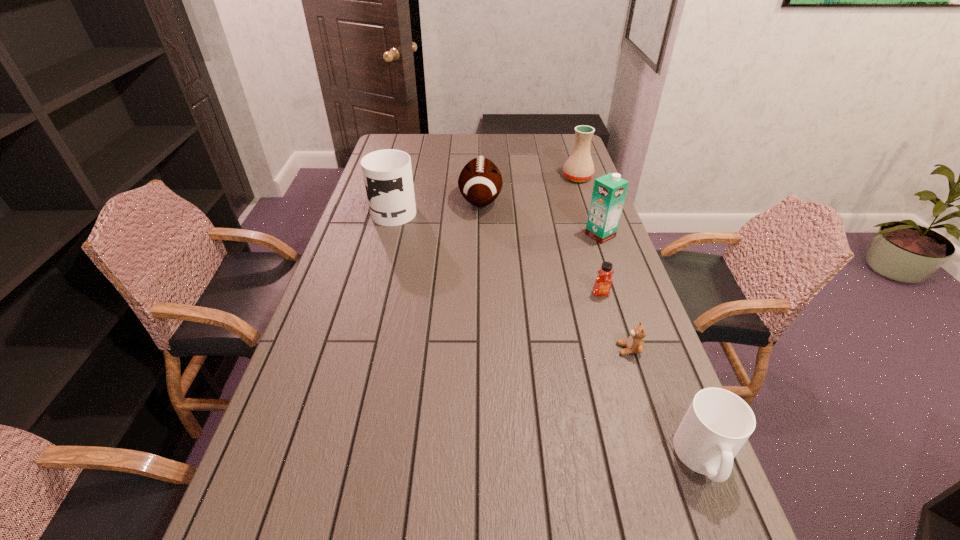
At what (x,y) coordinates should I click in order to perform the action: click on the farther mug. Please return your answer as a coordinate pair (x, y). Image resolution: width=960 pixels, height=540 pixels. Looking at the image, I should click on (387, 173).

Image resolution: width=960 pixels, height=540 pixels. Find the location of `the taller mug`. the taller mug is located at coordinates (387, 173).

Find the location of a particular element. The width and height of the screenshot is (960, 540). the nearest object is located at coordinates (718, 422).

At what (x,y) coordinates should I click in order to perform the action: click on the third shortest object. Please return your answer as a coordinate pair (x, y). This screenshot has width=960, height=540. Looking at the image, I should click on (718, 422).

Locate an element on the screen. This screenshot has width=960, height=540. pottery is located at coordinates (579, 167).

Locate an element on the screen. the fourth farthest object is located at coordinates (609, 191).

Identify the location of the second object from left to right. The height and width of the screenshot is (540, 960). (480, 182).

The height and width of the screenshot is (540, 960). What are the coordinates of `football (American)` in the screenshot? It's located at (480, 182).

Find the location of a particular element. honey is located at coordinates (603, 283).

Find the location of a particular element. Image resolution: width=960 pixels, height=540 pixels. the fifth farthest object is located at coordinates (603, 283).